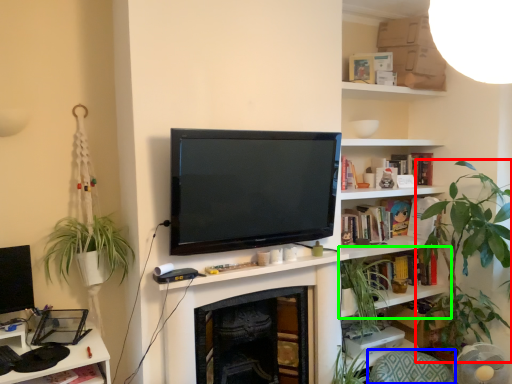
Question: Which object is positioned closest to houseplant (highlighted by a red box)? Select from swivel chair (highlighted by a blue box) and shelf (highlighted by a green box).

Choices:
 (A) swivel chair
 (B) shelf

Answer: (B)